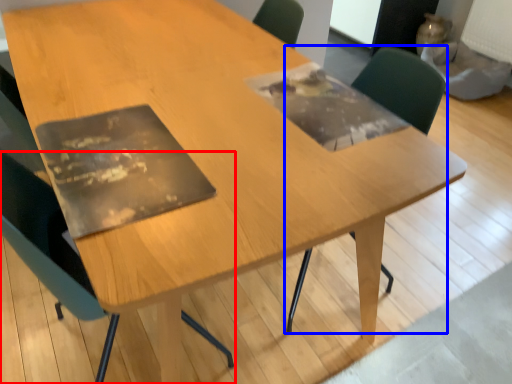
Question: Which object appears farthest to the camera in this image, chair (highlighted by a red box) or chair (highlighted by a blue box)?

Choices:
 (A) chair
 (B) chair

Answer: (B)